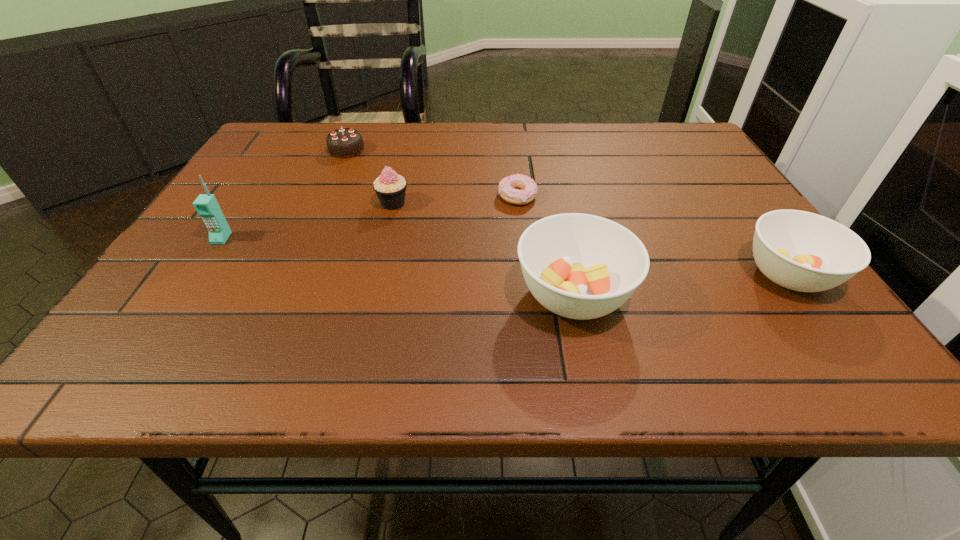
Identify the location of the left soup bowl. Image resolution: width=960 pixels, height=540 pixels. (580, 266).

Where is `the shorter soup bowl`? The image size is (960, 540). the shorter soup bowl is located at coordinates (798, 250).

Locate an element on the screen. the right soup bowl is located at coordinates (798, 250).

What are the coordinates of `the farthest object` in the screenshot? It's located at (345, 142).

Where is `the second object from left to right`? Image resolution: width=960 pixels, height=540 pixels. the second object from left to right is located at coordinates (345, 142).

I want to click on the leftmost object, so click(x=206, y=205).

Locate an element on the screen. This screenshot has width=960, height=540. the tallest object is located at coordinates (206, 205).

You are a GUI agent. You are given a task and a screenshot of the screen. Output one action in this format:
    pyautogui.click(x=<x>, y=<y>)
    Task: Click on the fourth object from right to left
    Image resolution: width=960 pixels, height=540 pixels.
    Given the screenshot: What is the action you would take?
    pyautogui.click(x=390, y=187)

The image size is (960, 540). I want to click on the shortest object, so click(508, 188).

You are a GUI agent. You are given a task and a screenshot of the screen. Output one action in this format:
    pyautogui.click(x=<x>, y=<y>)
    Task: Click on the vacant space located on the left of the taller soup bowl
    The height and width of the screenshot is (540, 960).
    Given the screenshot: What is the action you would take?
    pyautogui.click(x=396, y=295)